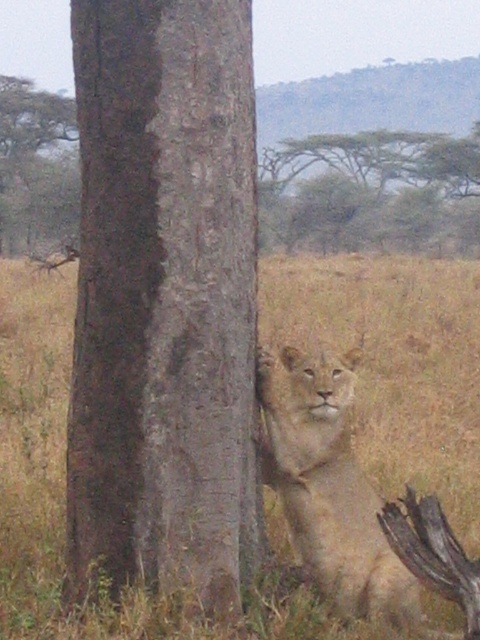
Consider the image. You are a wildlife photographer trying to capture a clear shot of the light brown fur lion at center and the smooth bark tree at upper left. Based on the scene, which object appears narrower in your camera viewfinder?

The light brown fur lion at center appears narrower than the smooth bark tree at upper left in the camera viewfinder.

You are a photographer trying to capture the lion in the savanna scene. You notice the brown rough bark at center and the dry grass at center. Which object is taller, making it more likely to block the lion from view?

The dry grass at center is taller than the brown rough bark at center, so it is more likely to block the lion from view.